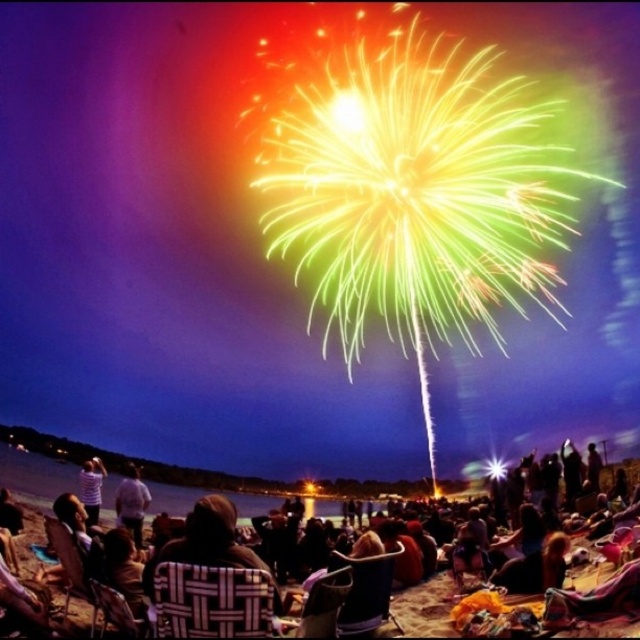
Can you confirm if white cotton shirt at lower left is taller than striped shirt at lower left?

Yes.

Which is in front, point (116, 520) or point (92, 486)?

Point (116, 520)

You are a GUI agent. You are given a task and a screenshot of the screen. Output one action in this format:
    pyautogui.click(x=<x>, y=<y>)
    Task: Click on the white cotton shirt at lower left
    
    Given the screenshot: What is the action you would take?
    pyautogui.click(x=131, y=502)

Is point (13, 449) positioned in front of point (90, 524)?

No, it is not.

The image size is (640, 640). I want to click on dark brown leather jacket at center, so click(33, 474).

Is dark brown leather jacket at center bigger than white cotton shirt at lower left?

Yes.

Is point (250, 502) farther from camera compared to point (128, 500)?

That is True.

Find the location of `dark brown leather jacket at center`. dark brown leather jacket at center is located at coordinates (33, 474).